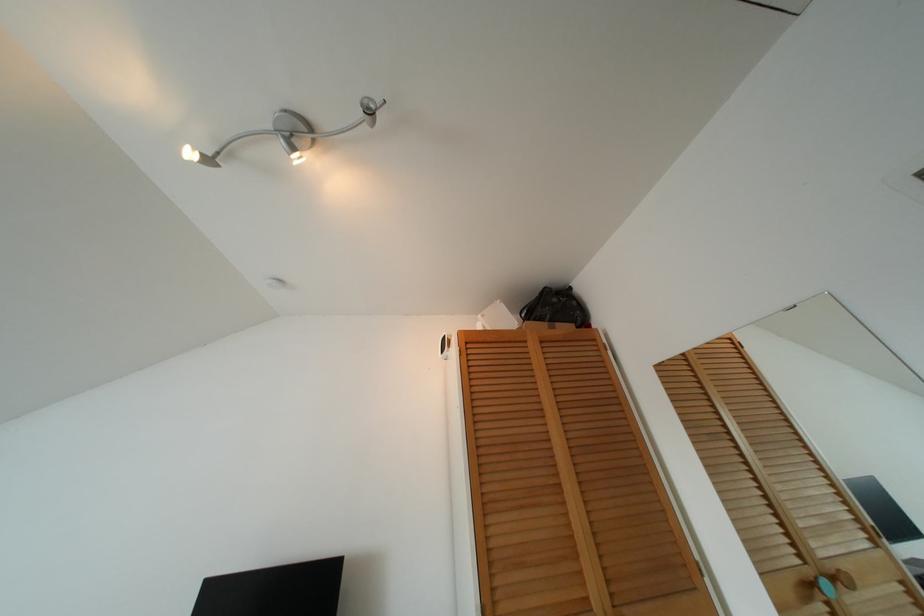
Which object does [495,317] point to?

It corresponds to the white box in the image.